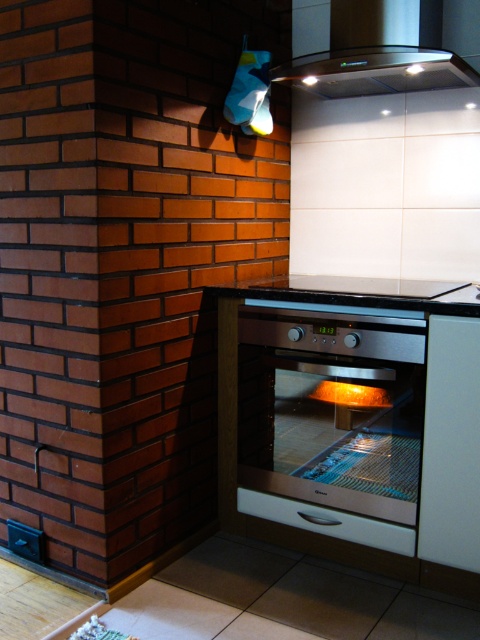
Question: Which point is farther from the camera taking this photo?

Choices:
 (A) (322, 532)
 (B) (349, 291)
 (C) (402, 32)
 (D) (389, 460)

Answer: (A)

Question: Considering the real-world distances, which object is farthest from the white glossy drawer at lower center?

Choices:
 (A) satin silver oven at center
 (B) satin black exhaust hood at upper center
 (C) black glass countertop at center

Answer: (B)

Question: Is satin silver oven at center to the right of black glass countertop at center from the viewer's perspective?

Choices:
 (A) no
 (B) yes

Answer: (A)

Question: In this image, where is black glass countertop at center located relative to white glossy drawer at lower center?

Choices:
 (A) below
 (B) above

Answer: (B)

Question: Is satin silver oven at center wider than white glossy drawer at lower center?

Choices:
 (A) no
 (B) yes

Answer: (B)

Question: Which of these objects is positioned closest to the black glass countertop at center?

Choices:
 (A) white glossy drawer at lower center
 (B) satin black exhaust hood at upper center

Answer: (A)